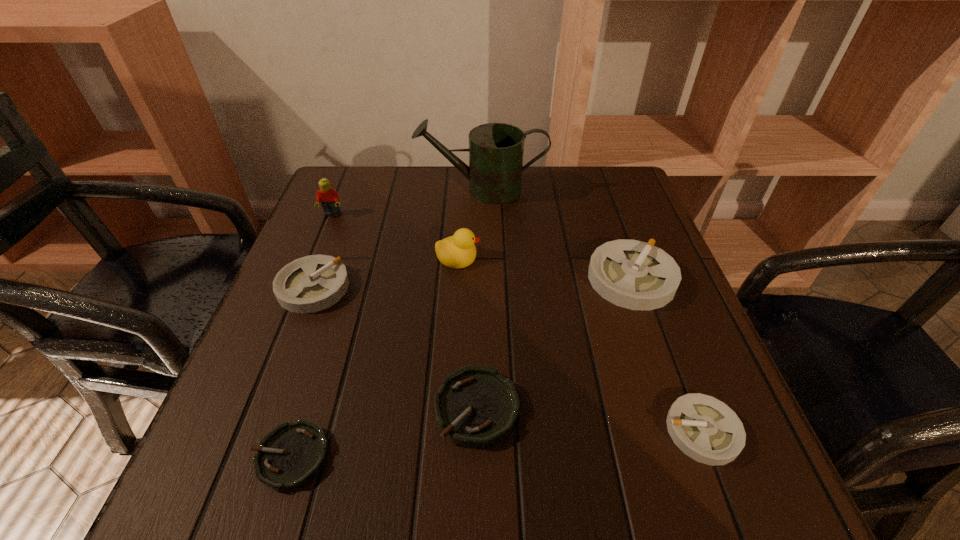
In order to click on the farthest object in this screenshot , I will do `click(496, 150)`.

Locate an element on the screen. This screenshot has height=540, width=960. watering can is located at coordinates tap(496, 150).

Image resolution: width=960 pixels, height=540 pixels. I want to click on Lego, so click(x=329, y=198).

Locate an element on the screen. Image resolution: width=960 pixels, height=540 pixels. the seventh shortest object is located at coordinates (329, 198).

The image size is (960, 540). Find the location of `the third tallest object`. the third tallest object is located at coordinates (458, 251).

In order to click on yellow duckling in this screenshot , I will do `click(458, 251)`.

I want to click on the fourth tallest object, so click(x=636, y=275).

The image size is (960, 540). I want to click on the biggest gray ashtray, so click(x=636, y=275).

Image resolution: width=960 pixels, height=540 pixels. Find the location of `the second biggest gray ashtray`. the second biggest gray ashtray is located at coordinates (312, 283).

Locate an element on the screen. This screenshot has width=960, height=540. the leftmost gray ashtray is located at coordinates (312, 283).